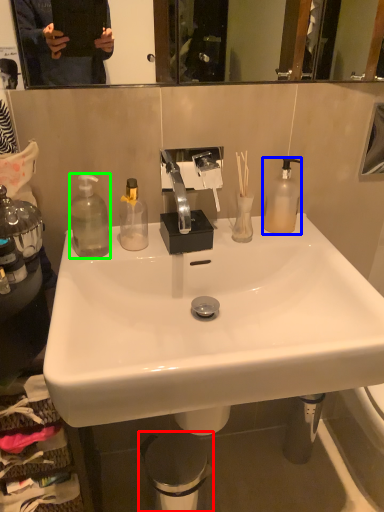
Question: Considering the real-world distances, which object is farthest from trash bin/can (highlighted by a red box)? bottle (highlighted by a blue box) or bottle (highlighted by a green box)?

Choices:
 (A) bottle
 (B) bottle

Answer: (A)